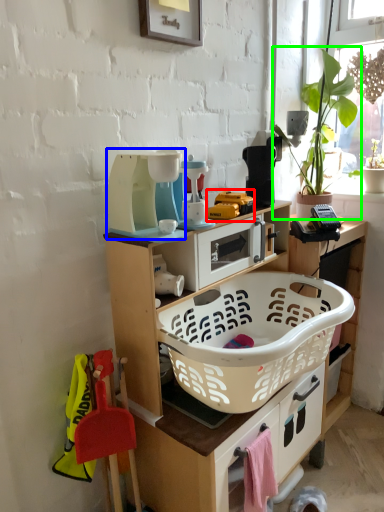
Question: Estimate the real-world distances between objects in this image. Which object is closer to toy (highlighted by a red box), appliance (highlighted by a blue box) or houseplant (highlighted by a green box)?

Choices:
 (A) appliance
 (B) houseplant

Answer: (A)